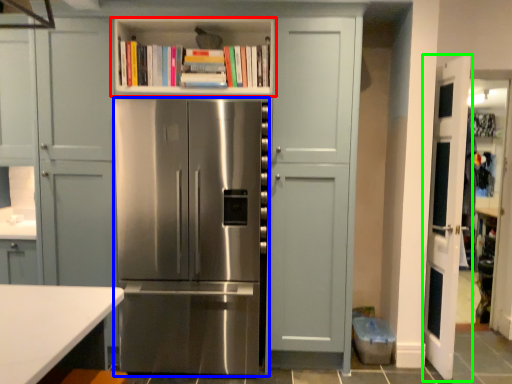
Question: Based on their relative distances, which object is nearer to shelf (highlighted by a red box)? Choose from refrigerator (highlighted by a blue box) and door (highlighted by a green box).

Choices:
 (A) refrigerator
 (B) door

Answer: (A)